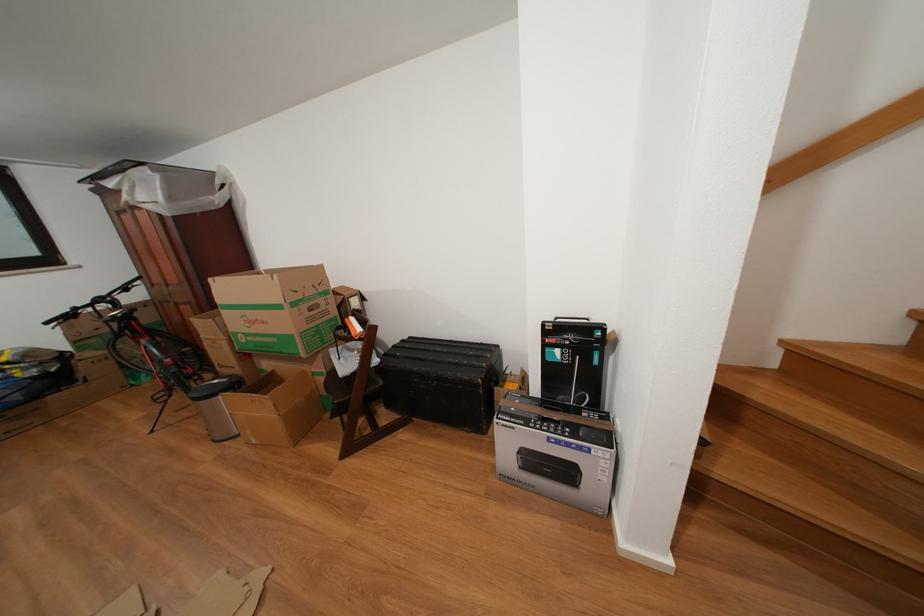
You are a GUI agent. You are given a task and a screenshot of the screen. Output one action in this format:
    pyautogui.click(x=<x>, y=<y>)
    Task: Click on the bicycle pedal
    The height and width of the screenshot is (616, 924).
    Given the screenshot: What is the action you would take?
    pyautogui.click(x=162, y=395)